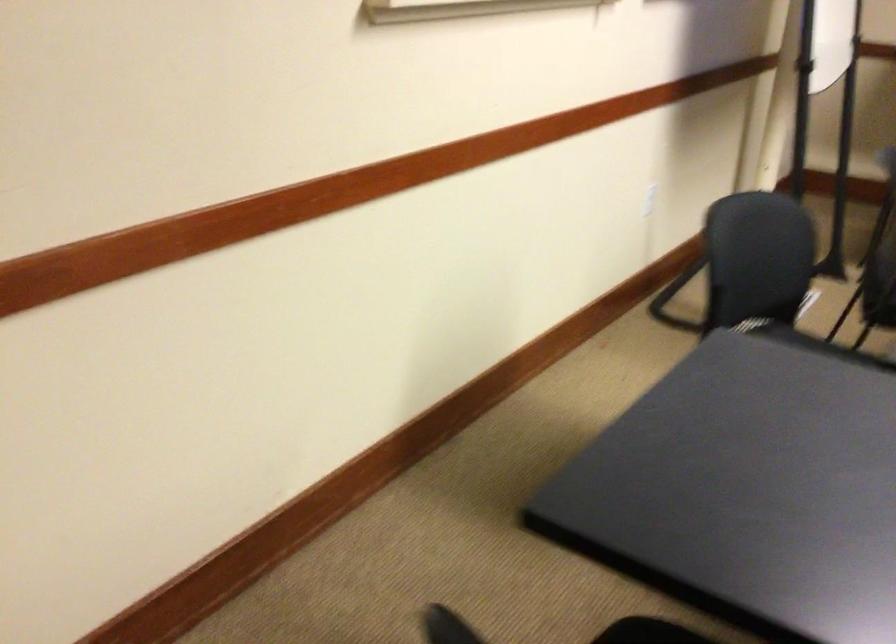
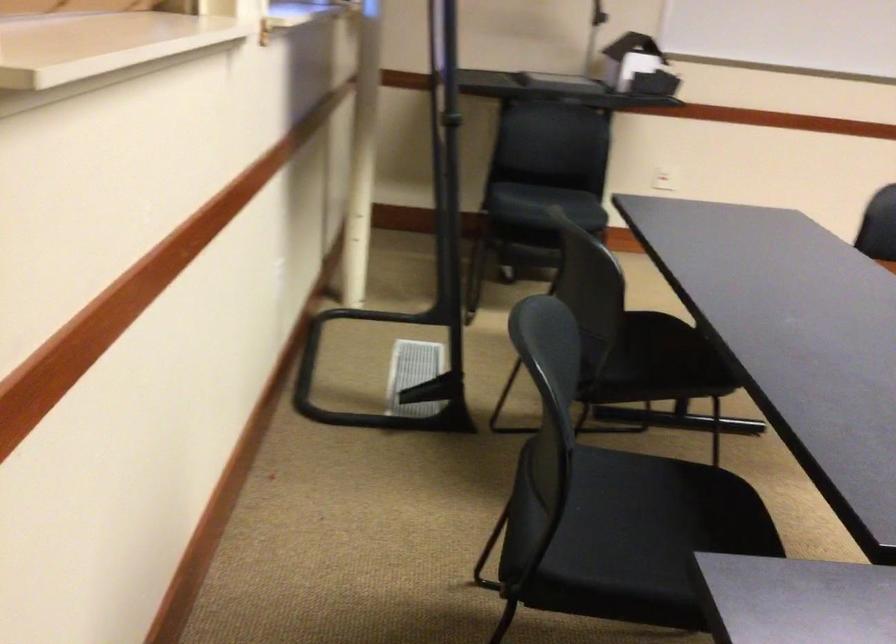
Question: Which direction would the cameraman need to move to produce the second image? Reply with the corresponding letter.

Choices:
 (A) Left
 (B) Right
 (C) Forward
 (D) Backward

Answer: (D)